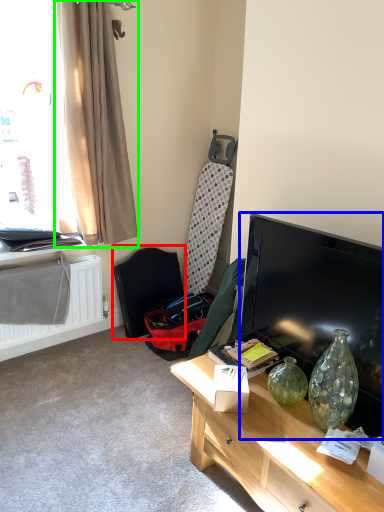
Question: Which is nearer to the swivel chair (highlighted by a red box)? television (highlighted by a blue box) or curtain (highlighted by a green box).

Choices:
 (A) television
 (B) curtain

Answer: (B)